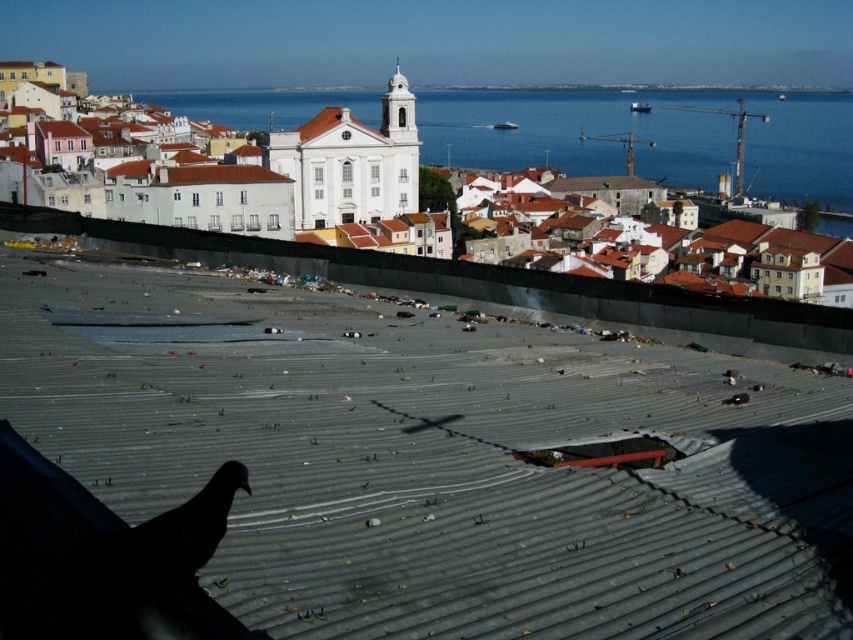
Is metallic harbor at center positioned at the back of black matte pigeon at lower left?

Yes.

Between metallic harbor at center and black matte pigeon at lower left, which one has more height?

With more height is metallic harbor at center.

Does point (633, 465) come closer to viewer compared to point (180, 525)?

No, it is not.

Locate an element on the screen. metallic harbor at center is located at coordinates (434, 458).

Between point (171, 531) and point (497, 129), which one is positioned in front?

Point (171, 531)

Does black matte bird at lower left have a greater height compared to white plastic boat at center?

In fact, black matte bird at lower left may be shorter than white plastic boat at center.

Identify the location of black matte bird at lower left. (180, 532).

Locate an element on the screen. This screenshot has height=640, width=853. black matte bird at lower left is located at coordinates pos(180,532).

Does metallic harbor at center have a lesser width compared to brown tile roof at center?

No.

Is metallic harbor at center above brown tile roof at center?

No.

The width and height of the screenshot is (853, 640). I want to click on metallic harbor at center, so click(x=434, y=458).

Where is `metallic harbor at center`? metallic harbor at center is located at coordinates (434, 458).